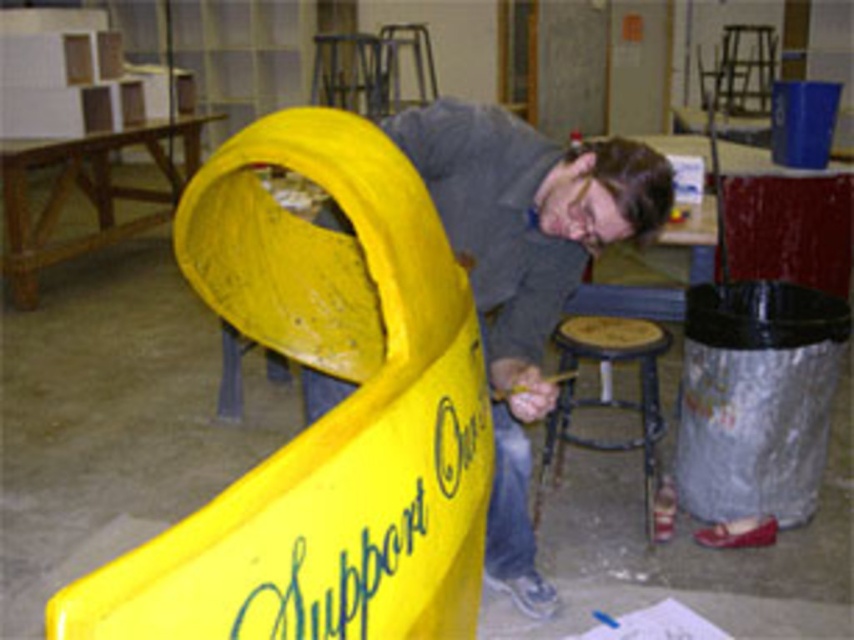
You are a maintenance worker in the workshop. You need to place a new tool box on the highest available surface. Which object should you choose between the yellow plastic slide at left and the wooden stool at lower center?

The yellow plastic slide at left has a greater height compared to the wooden stool at lower center, so you should place the tool box on the yellow plastic slide at left.

You are a maintenance worker in the workshop. You need to reach the yellow plastic slide at left to inspect it. The slide is located at point 0.650 meters in the x direction and 0.381 meters in the y direction from your current position. Can you safely reach it without moving more than 1 meter in any direction?

The yellow plastic slide at left is located at point 0.650 meters in the x direction and 0.381 meters in the y direction from your current position. Since the maximum distance you can move in any direction is 1 meter, and both coordinates are within that limit, you can safely reach it without exceeding the 1 meter limit in either direction.